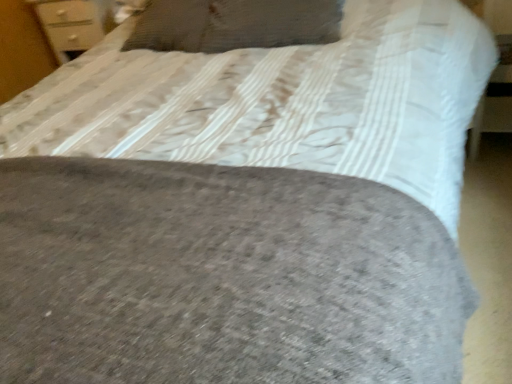
Question: Should I look upward or downward to see matte white dresser at upper left?

Choices:
 (A) down
 (B) up

Answer: (B)

Question: Can you confirm if woolen pillow at upper center is wider than matte white dresser at upper left?

Choices:
 (A) yes
 (B) no

Answer: (A)

Question: From the image's perspective, would you say woolen pillow at upper center is shown under matte white dresser at upper left?

Choices:
 (A) no
 (B) yes

Answer: (B)

Question: From the image's perspective, does woolen pillow at upper center appear higher than matte white dresser at upper left?

Choices:
 (A) yes
 (B) no

Answer: (B)

Question: Does woolen pillow at upper center come in front of matte white dresser at upper left?

Choices:
 (A) no
 (B) yes

Answer: (B)

Question: From a real-world perspective, is woolen pillow at upper center beneath matte white dresser at upper left?

Choices:
 (A) yes
 (B) no

Answer: (B)

Question: Would you say matte white dresser at upper left is part of woolen pillow at upper center's contents?

Choices:
 (A) yes
 (B) no

Answer: (B)

Question: Considering the relative sizes of matte white dresser at upper left and woolen pillow at upper center in the image provided, is matte white dresser at upper left thinner than woolen pillow at upper center?

Choices:
 (A) yes
 (B) no

Answer: (A)

Question: Is matte white dresser at upper left bigger than woolen pillow at upper center?

Choices:
 (A) no
 (B) yes

Answer: (B)

Question: Is matte white dresser at upper left facing away from woolen pillow at upper center?

Choices:
 (A) no
 (B) yes

Answer: (A)

Question: Is there a large distance between matte white dresser at upper left and woolen pillow at upper center?

Choices:
 (A) no
 (B) yes

Answer: (A)

Question: Considering the relative positions of matte white dresser at upper left and woolen pillow at upper center in the image provided, is matte white dresser at upper left to the left of woolen pillow at upper center from the viewer's perspective?

Choices:
 (A) no
 (B) yes

Answer: (B)

Question: Is matte white dresser at upper left positioned beyond the bounds of woolen pillow at upper center?

Choices:
 (A) yes
 (B) no

Answer: (A)

Question: Based on their positions, is matte white dresser at upper left located to the left or right of woolen pillow at upper center?

Choices:
 (A) right
 (B) left

Answer: (B)